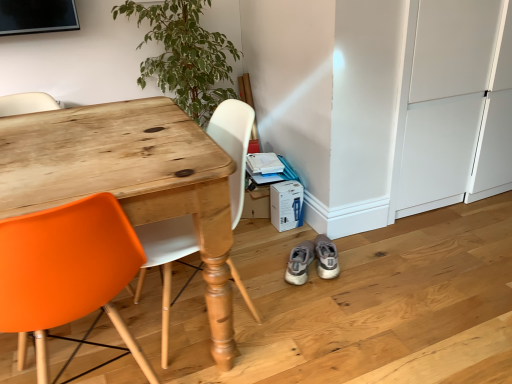
Question: Is light gray suede sneakers at lower center, positioned as the second footwear in left-to-right order, bigger or smaller than green leafy plant at upper left?

Choices:
 (A) small
 (B) big

Answer: (A)

Question: From the image's perspective, is light gray suede sneakers at lower center, the 1th footwear from the right, above or below green leafy plant at upper left?

Choices:
 (A) below
 (B) above

Answer: (A)

Question: Which object is positioned farthest from the green leafy plant at upper left?

Choices:
 (A) gray suede sneakers at lower right, which is the 1th footwear from left to right
 (B) light gray suede sneakers at lower center, positioned as the second footwear in left-to-right order
 (C) white cardboard box at lower center
 (D) wooden desk at left

Answer: (B)

Question: Which object is positioned closest to the green leafy plant at upper left?

Choices:
 (A) white cardboard box at lower center
 (B) wooden desk at left
 (C) gray suede sneakers at lower right, which ranks as the second footwear in right-to-left order
 (D) light gray suede sneakers at lower center, the 1th footwear from the right

Answer: (B)